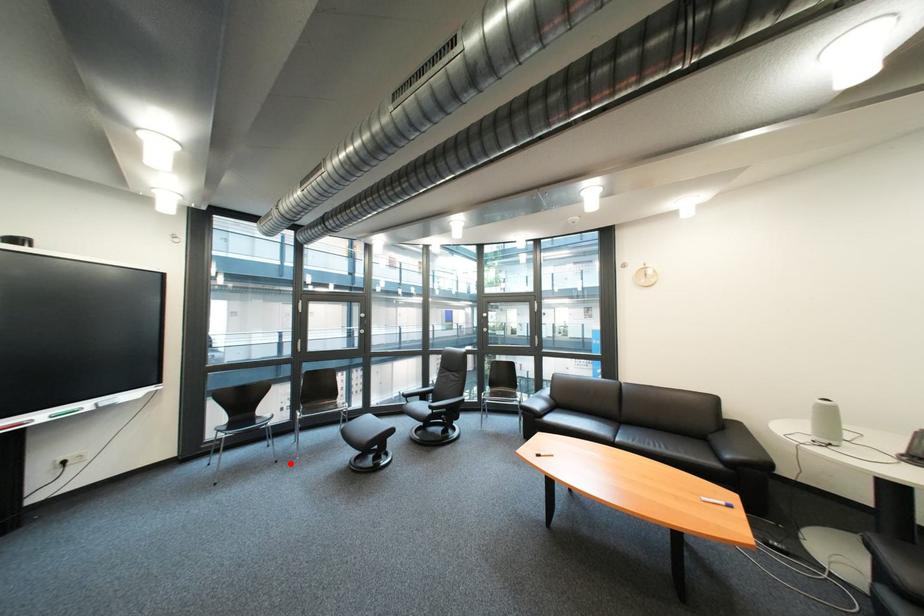
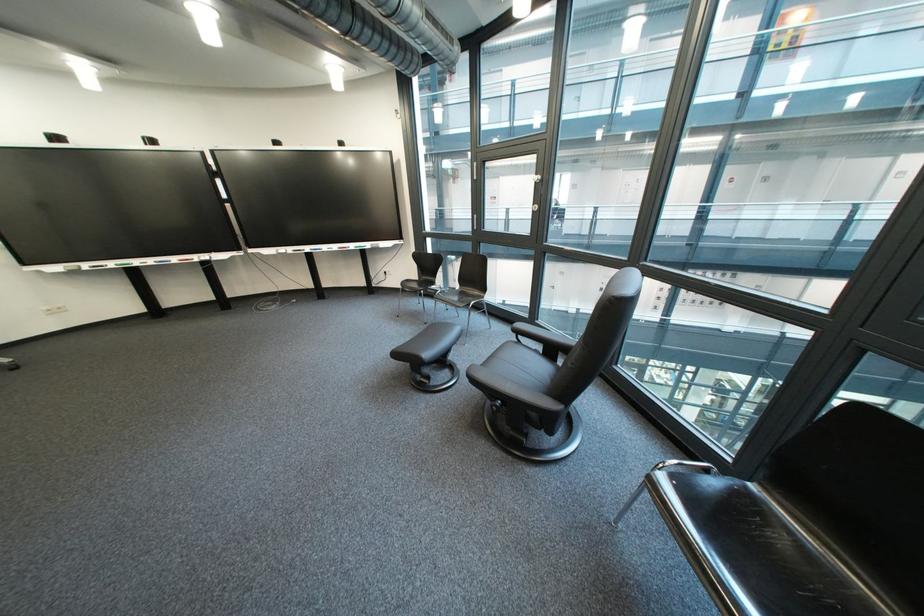
Question: I am providing you with two images of the same scene from different viewpoints. In image1, a red point is highlighted. Considering the same 3D point in image2, which of the following is correct?

Choices:
 (A) It is closer
 (B) It is farther

Answer: (B)